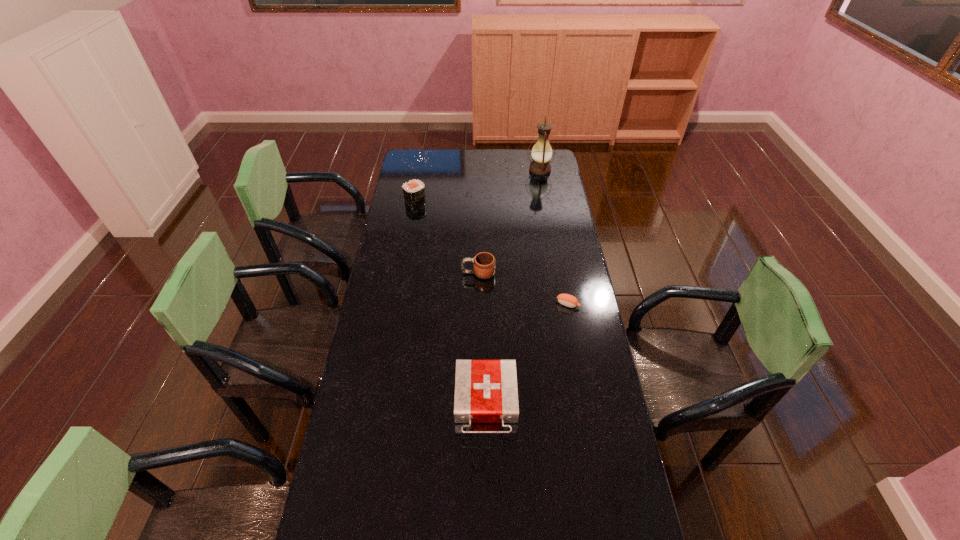
Find the location of a particular element. The width and height of the screenshot is (960, 540). sushi that is at the right edge is located at coordinates (568, 300).

Identify the location of object that is at the far right corner. The width and height of the screenshot is (960, 540). (541, 153).

Where is `blank space at the far edge of the desktop`? The image size is (960, 540). blank space at the far edge of the desktop is located at coordinates (511, 159).

In the image, there is a desktop. Where is `vacant space at the left edge`? This screenshot has width=960, height=540. vacant space at the left edge is located at coordinates (353, 512).

At what (x,y) coordinates should I click in order to perform the action: click on free space at the right edge. Please return your answer as a coordinate pair (x, y). The height and width of the screenshot is (540, 960). Looking at the image, I should click on (544, 180).

Image resolution: width=960 pixels, height=540 pixels. I want to click on vacant region at the far right corner of the desktop, so click(x=532, y=151).

Find the location of a particular element. This screenshot has height=540, width=960. free space between the leftmost object and the oil lamp is located at coordinates (477, 185).

You are a GUI agent. You are given a task and a screenshot of the screen. Output one action in this format:
    pyautogui.click(x=<x>, y=<y>)
    Task: Click on the vacant space that's between the third farthest object and the oil lamp
    The height and width of the screenshot is (540, 960).
    Given the screenshot: What is the action you would take?
    pyautogui.click(x=509, y=221)

You are a GUI agent. You are given a task and a screenshot of the screen. Output one action in this format:
    pyautogui.click(x=<x>, y=<y>)
    Task: Click on the free space between the fourth nearest object and the second shortest object
    The height and width of the screenshot is (540, 960).
    Given the screenshot: What is the action you would take?
    pyautogui.click(x=450, y=301)

Locate an element on the screen. This screenshot has height=540, width=960. empty space that is in between the taller sushi and the third shortest object is located at coordinates (446, 237).